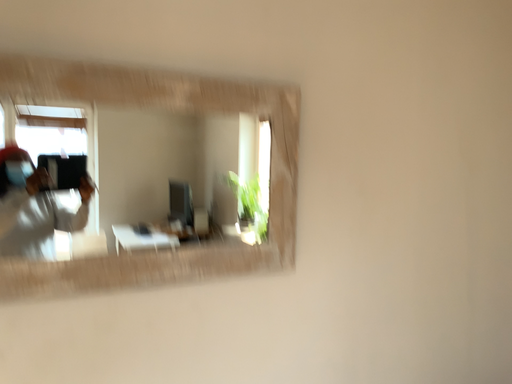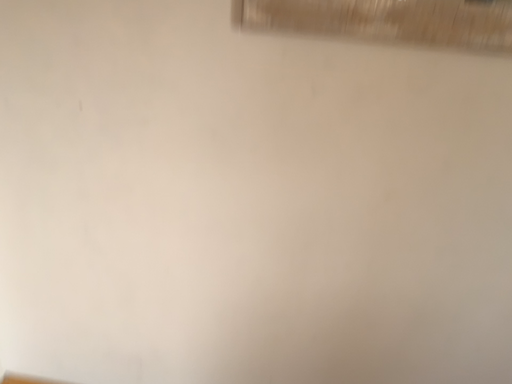
Question: How did the camera likely rotate when shooting the video?

Choices:
 (A) rotated right
 (B) rotated left

Answer: (B)